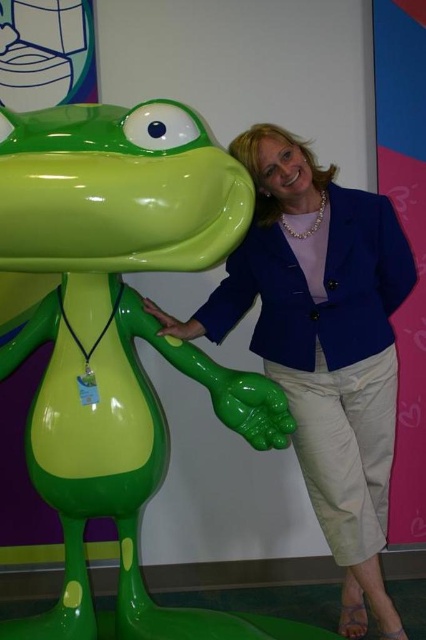
You are standing in front of two statues at the center of the scene. The glossy plastic frog at center and the matte green statue at center. Which one is positioned to the left?

The glossy plastic frog at center is positioned to the left of the matte green statue at center.

You are a photographer setting up for a group photo. You need to position two subjects between the glossy plastic frog at center and the matte green statue at center. The minimum distance required between each subject and the objects is 40 centimeters. Can both subjects be placed within this space?

The glossy plastic frog at center and matte green statue at center are 42.01 centimeters apart. Since the required minimum distance for each subject is 40 centimeters, placing two subjects between them would require at least 80 centimeters of space, which exceeds the available 42.01 centimeters. Therefore, it is not possible to place both subjects within this space.